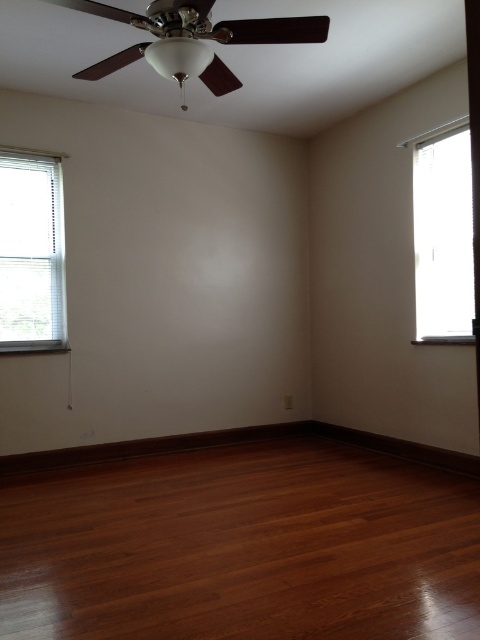
You are standing in the room and want to place a 3.5 feet tall plant stand exactly at point (233, 593). Considering the distance from you to that point is 6.80 feet, will you be able to reach the top of the plant stand without moving closer?

The distance from you to point (233, 593) is 6.80 feet. The plant stand is 3.5 feet tall. Since the distance is greater than the height, you can reach the top without needing to move closer.

You are standing in the room and want to move from one point to another. Which point, point [180,472] or point [39,253], is closer to you?

Point [180,472] is closer to the viewer than point [39,253].